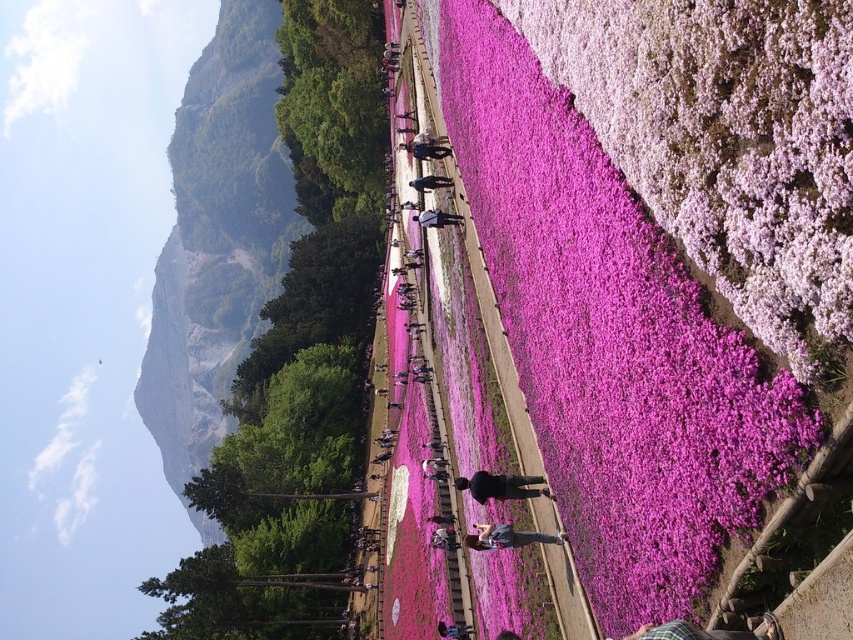
Question: Does pink fluffy petals at center have a larger size compared to green leafy hillside at upper left?

Choices:
 (A) yes
 (B) no

Answer: (B)

Question: Among these objects, which one is nearest to the camera?

Choices:
 (A) pink fluffy petals at center
 (B) green leafy hillside at upper left

Answer: (A)

Question: Is pink fluffy petals at center above green leafy hillside at upper left?

Choices:
 (A) yes
 (B) no

Answer: (B)

Question: Which point is closer to the camera?

Choices:
 (A) pink fluffy petals at center
 (B) green leafy hillside at upper left

Answer: (A)

Question: Does pink fluffy petals at center lie behind green leafy hillside at upper left?

Choices:
 (A) yes
 (B) no

Answer: (B)